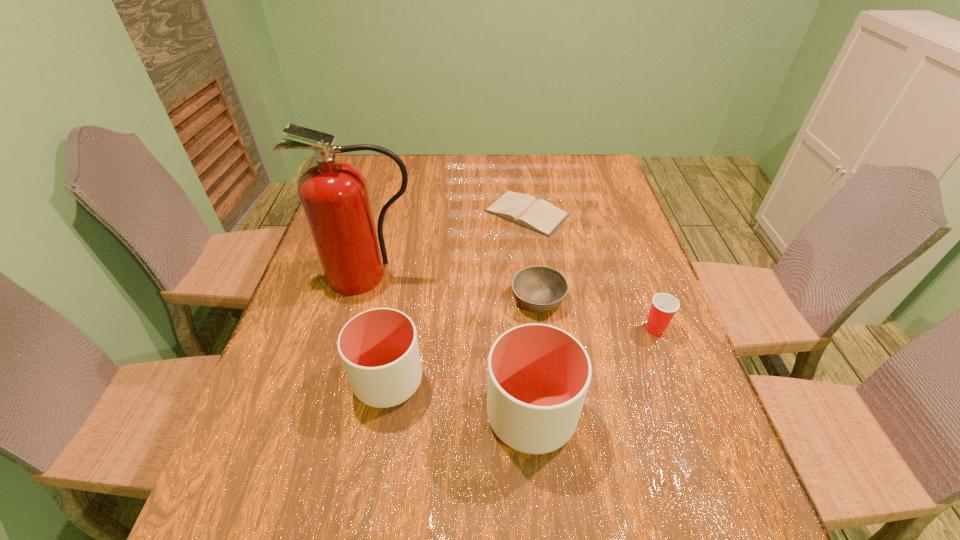
All cups are currently evenly spaced. To continue this pattern, where would you add another cup on the right? Please point out a vacant spot. Please provide its 2D coordinates. Your answer should be formatted as a tuple, i.e. [(x, y)], where the tuple contains the x and y coordinates of a point satisfying the conditions above.

[(695, 455)]